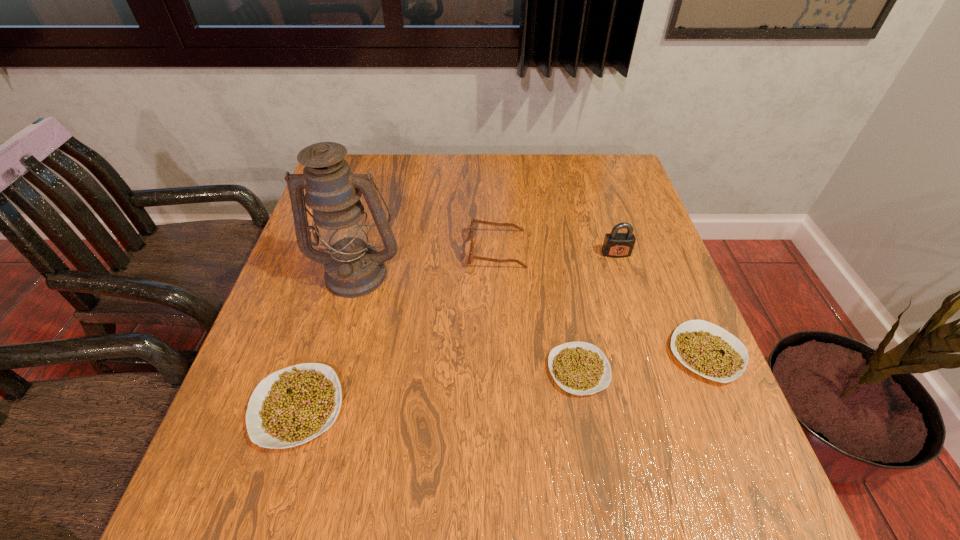
To make them evenly spaced by inserting another legume among them, please locate a vacant spot for this new legume. Please provide its 2D coordinates. Your answer should be formatted as a tuple, i.e. [(x, y)], where the tuple contains the x and y coordinates of a point satisfying the conditions above.

[(443, 388)]